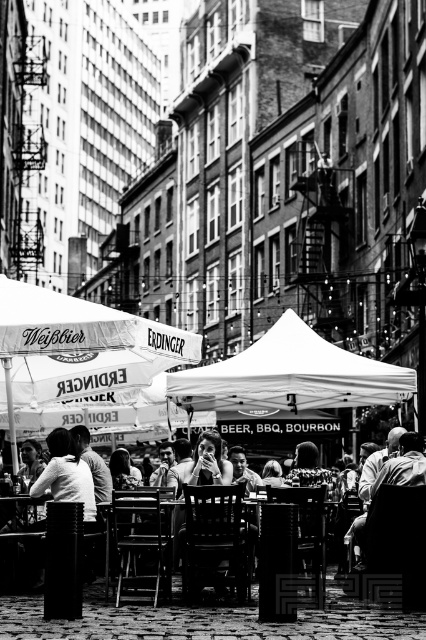
Is white fabric canopy at center thinner than dark hair at lower right?

No.

Is point (307, 397) positioned in front of point (414, 460)?

No, it is not.

The width and height of the screenshot is (426, 640). What are the coordinates of `white fabric canopy at center` in the screenshot? It's located at (290, 376).